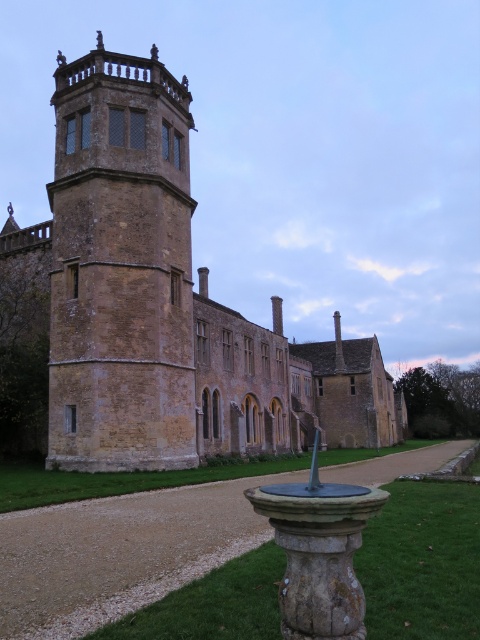
Question: Does brown stone castle at center have a larger size compared to brown stone tower at upper left?

Choices:
 (A) yes
 (B) no

Answer: (A)

Question: Is brown stone castle at center smaller than brown stone tower at upper left?

Choices:
 (A) no
 (B) yes

Answer: (A)

Question: Which of the following is the farthest from the observer?

Choices:
 (A) (100, 44)
 (B) (240, 330)

Answer: (B)

Question: Is the position of brown stone castle at center less distant than that of brown stone tower at upper left?

Choices:
 (A) no
 (B) yes

Answer: (A)